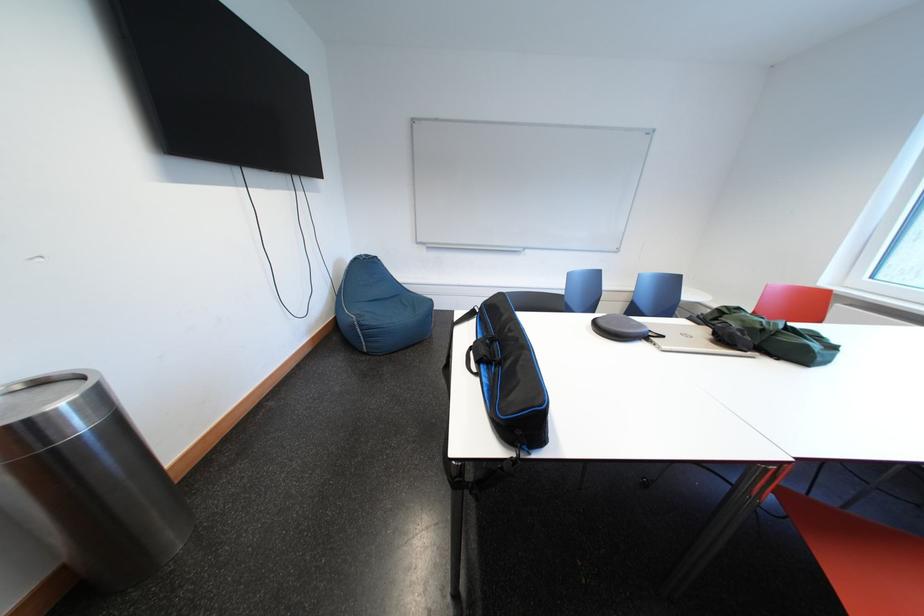
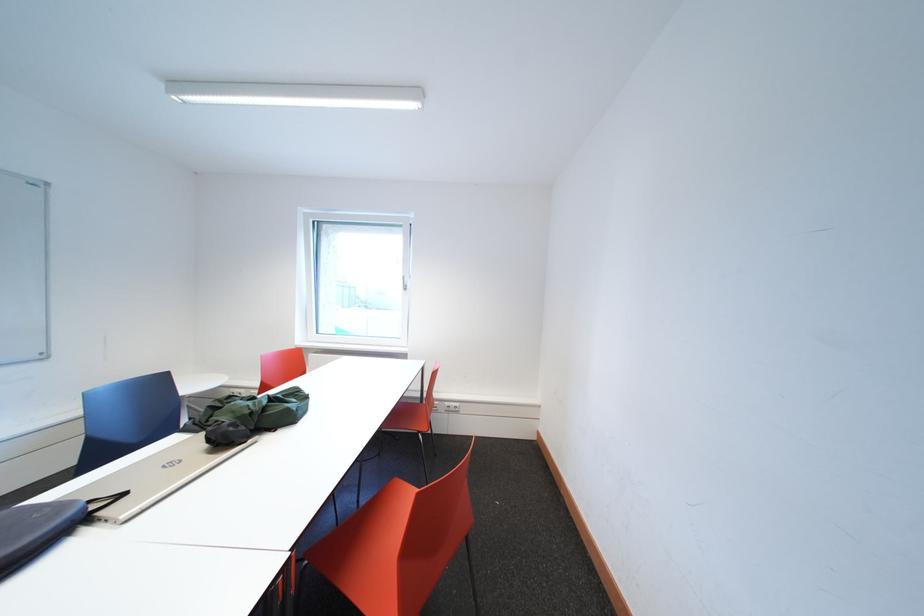
Locate, in the second image, the point that corresponds to point 672,341 in the first image.

(134, 499)